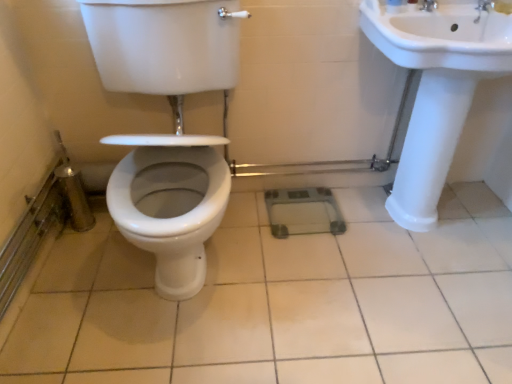
Identify the location of vacant area that lies between white glossy toilet at center and white glossy sink at right. (332, 271).